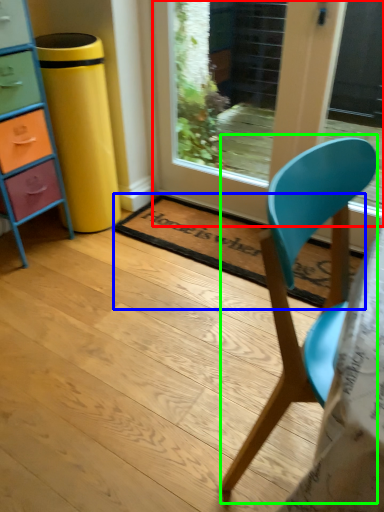
Question: Estimate the real-world distances between objects in this image. Which object is closer to door (highlighted by a red box), mat (highlighted by a blue box) or chair (highlighted by a green box)?

Choices:
 (A) mat
 (B) chair

Answer: (A)